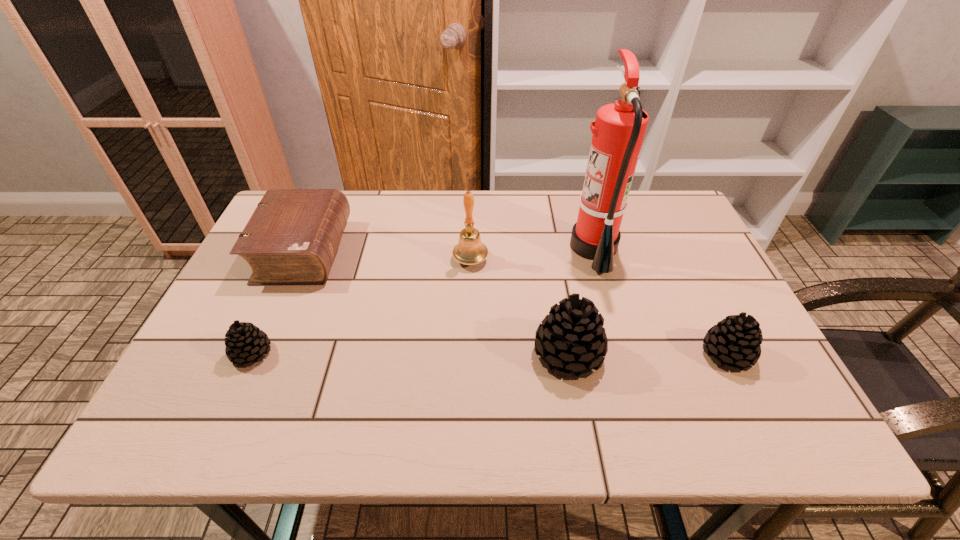
Locate an element on the screen. The image size is (960, 540). free spot located at the narrow end of the second pinecone from right to left is located at coordinates (441, 354).

At what (x,y) coordinates should I click in order to perform the action: click on vacant region located at the narrow end of the second pinecone from right to left. Please return your answer as a coordinate pair (x, y). Image resolution: width=960 pixels, height=540 pixels. Looking at the image, I should click on (471, 354).

At what (x,y) coordinates should I click in order to perform the action: click on vacant space located at the narrow end of the second pinecone from right to left. Please return your answer as a coordinate pair (x, y). Looking at the image, I should click on (498, 354).

At what (x,y) coordinates should I click in order to perform the action: click on free space located at the narrow end of the rightmost pinecone. Please return your answer as a coordinate pair (x, y). Looking at the image, I should click on (666, 354).

You are a GUI agent. You are given a task and a screenshot of the screen. Output one action in this format:
    pyautogui.click(x=<x>, y=<y>)
    Task: Click on the free point located at the narrow end of the rightmost pinecone
    
    Given the screenshot: What is the action you would take?
    pyautogui.click(x=596, y=354)

Locate an element on the screen. free space located at the narrow end of the rightmost pinecone is located at coordinates (x=588, y=354).

The image size is (960, 540). Identify the location of vacant area situated 0.180m at the nozzle of the tallest object. (508, 248).

Identify the location of vacant region located 0.230m at the nozzle of the tallest object. The width and height of the screenshot is (960, 540). (491, 248).

The image size is (960, 540). Find the location of `free location located 0.110m at the nozzle of the tallest object`. free location located 0.110m at the nozzle of the tallest object is located at coordinates (533, 248).

Locate an element on the screen. The width and height of the screenshot is (960, 540). vacant space located on the spine side of the Bible is located at coordinates (463, 251).